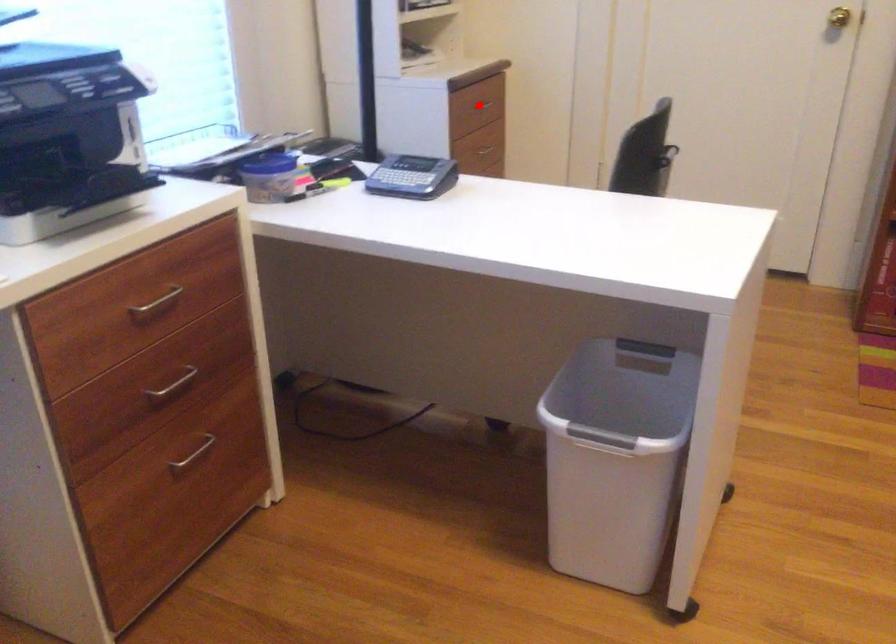
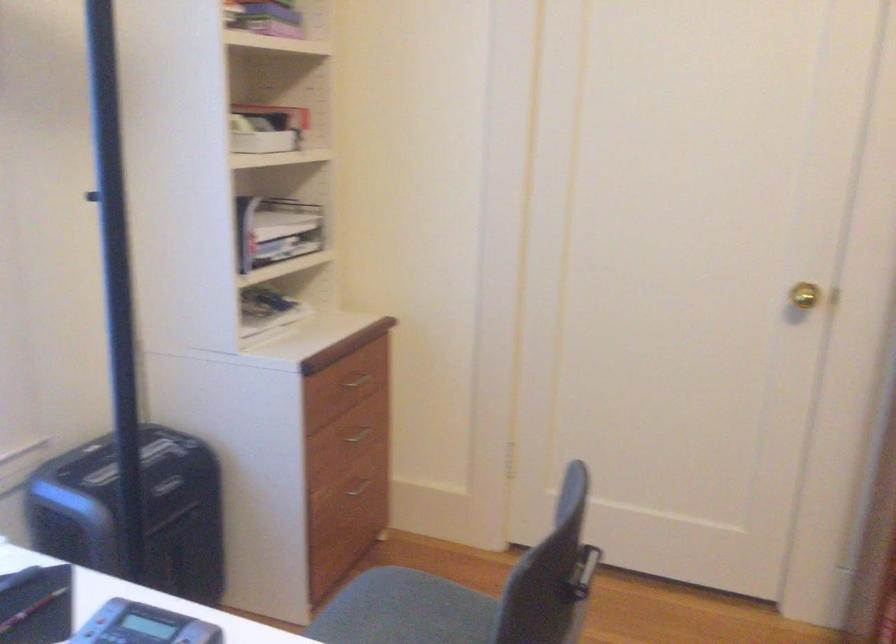
Question: I am providing you with two images of the same scene from different viewpoints. Image1 has a red point marked. In image2, the corresponding 3D location appears at what relative position? Reply with the corresponding letter.

Choices:
 (A) Closer
 (B) Farther

Answer: (A)